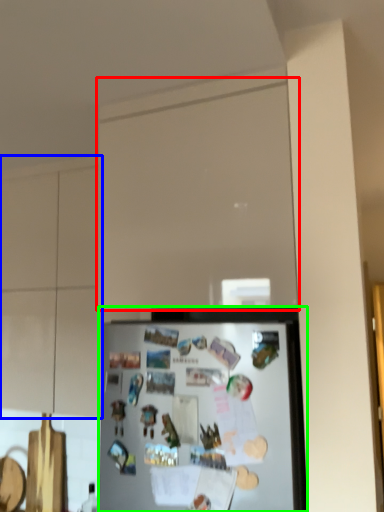
Question: Based on their relative distances, which object is farther from glass door (highlighted by a red box)? Choose from cabinetry (highlighted by a blue box) and refrigerator (highlighted by a green box).

Choices:
 (A) cabinetry
 (B) refrigerator

Answer: (A)